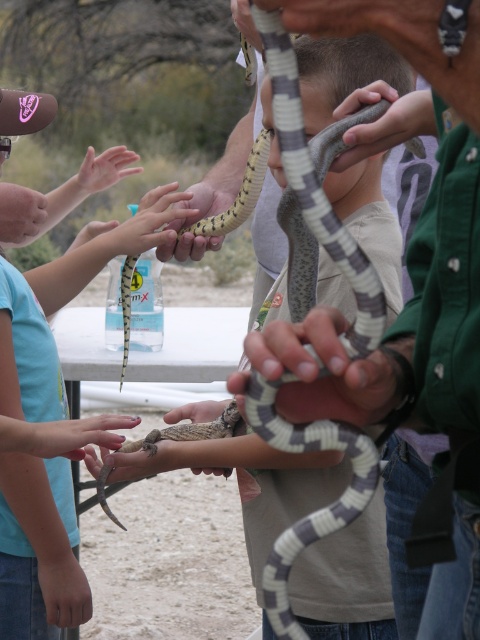
Question: Among these objects, which one is farthest from the camera?

Choices:
 (A) smooth tan snake at center
 (B) smooth skin hand at center

Answer: (B)

Question: Which point is farther from the camera taking this photo?

Choices:
 (A) (172, 420)
 (B) (21, 326)
 (C) (340, 515)

Answer: (B)

Question: Is gray and white striped snake at center positioned before smooth skin hand at center?

Choices:
 (A) yes
 (B) no

Answer: (A)

Question: From the image, what is the correct spatial relationship of smooth tan snake at center in relation to smooth skin hand at center?

Choices:
 (A) above
 (B) below

Answer: (A)

Question: Can you confirm if gray and white striped snake at center is bigger than smooth skin hand at center?

Choices:
 (A) no
 (B) yes

Answer: (B)

Question: Among these points, which one is nearest to the camera?

Choices:
 (A) (376, 492)
 (B) (199, 417)

Answer: (A)